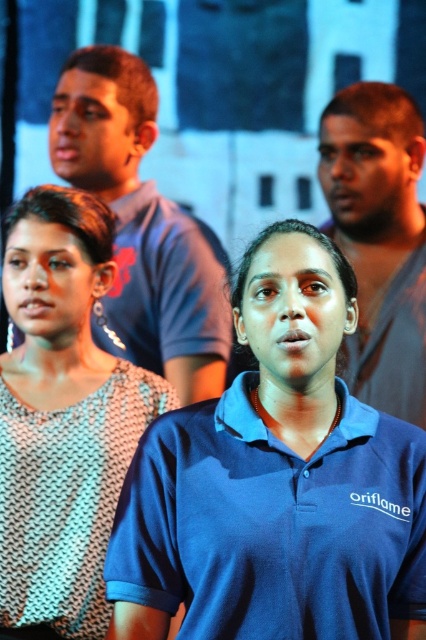
You are a GUI agent. You are given a task and a screenshot of the screen. Output one action in this format:
    pyautogui.click(x=<x>, y=<y>)
    Task: Click on the matte blue shirt at upper center
    This screenshot has height=640, width=426.
    Given the screenshot: What is the action you would take?
    pyautogui.click(x=143, y=225)

Is matte blue shirt at upper center to the right of matte gray shirt at center from the viewer's perspective?

In fact, matte blue shirt at upper center is to the left of matte gray shirt at center.

Who is more forward, [167,368] or [403,358]?

Point [403,358] is more forward.

At what (x,y) coordinates should I click in order to perform the action: click on matte blue shirt at upper center. Please return your answer as a coordinate pair (x, y). This screenshot has height=640, width=426. Looking at the image, I should click on (143, 225).

Is blue smooth polo shirt at center in front of knitted fabric top at center?

That is True.

Between blue smooth polo shirt at center and knitted fabric top at center, which one appears on the left side from the viewer's perspective?

From the viewer's perspective, knitted fabric top at center appears more on the left side.

You are a GUI agent. You are given a task and a screenshot of the screen. Output one action in this format:
    pyautogui.click(x=<x>, y=<y>)
    Task: Click on the blue smooth polo shirt at center
    This screenshot has height=640, width=426.
    Given the screenshot: What is the action you would take?
    pyautogui.click(x=273, y=524)

In the scene shown: Does blue smooth polo shirt at center have a smaller size compared to matte gray shirt at center?

Yes.

Can you confirm if blue smooth polo shirt at center is bigger than matte gray shirt at center?

Actually, blue smooth polo shirt at center might be smaller than matte gray shirt at center.

Identify the location of blue smooth polo shirt at center. The width and height of the screenshot is (426, 640). (273, 524).